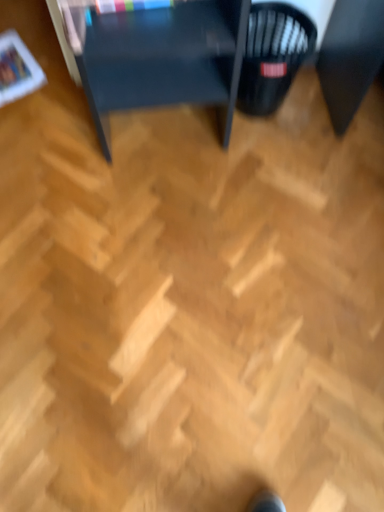
Question: Is matte black table at upper center to the left of black plastic basket at center right from the viewer's perspective?

Choices:
 (A) yes
 (B) no

Answer: (A)

Question: Is matte black table at upper center to the right of black plastic basket at center right from the viewer's perspective?

Choices:
 (A) no
 (B) yes

Answer: (A)

Question: From the image's perspective, would you say matte black table at upper center is positioned over black plastic basket at center right?

Choices:
 (A) no
 (B) yes

Answer: (B)

Question: Is matte black table at upper center closer to the viewer compared to black plastic basket at center right?

Choices:
 (A) yes
 (B) no

Answer: (A)

Question: Is matte black table at upper center with black plastic basket at center right?

Choices:
 (A) no
 (B) yes

Answer: (A)

Question: Can you confirm if matte black table at upper center is wider than black plastic basket at center right?

Choices:
 (A) yes
 (B) no

Answer: (A)

Question: Does black plastic basket at center right have a lesser width compared to matte black table at upper center?

Choices:
 (A) no
 (B) yes

Answer: (B)

Question: From a real-world perspective, is black plastic basket at center right below matte black table at upper center?

Choices:
 (A) yes
 (B) no

Answer: (A)

Question: Considering the relative sizes of black plastic basket at center right and matte black table at upper center in the image provided, is black plastic basket at center right bigger than matte black table at upper center?

Choices:
 (A) no
 (B) yes

Answer: (A)

Question: Can you confirm if black plastic basket at center right is positioned to the left of matte black table at upper center?

Choices:
 (A) yes
 (B) no

Answer: (B)

Question: Does black plastic basket at center right come in front of matte black table at upper center?

Choices:
 (A) no
 (B) yes

Answer: (A)

Question: Can you confirm if black plastic basket at center right is shorter than matte black table at upper center?

Choices:
 (A) no
 (B) yes

Answer: (B)

Question: From their relative heights in the image, would you say matte black table at upper center is taller or shorter than black plastic basket at center right?

Choices:
 (A) short
 (B) tall

Answer: (B)